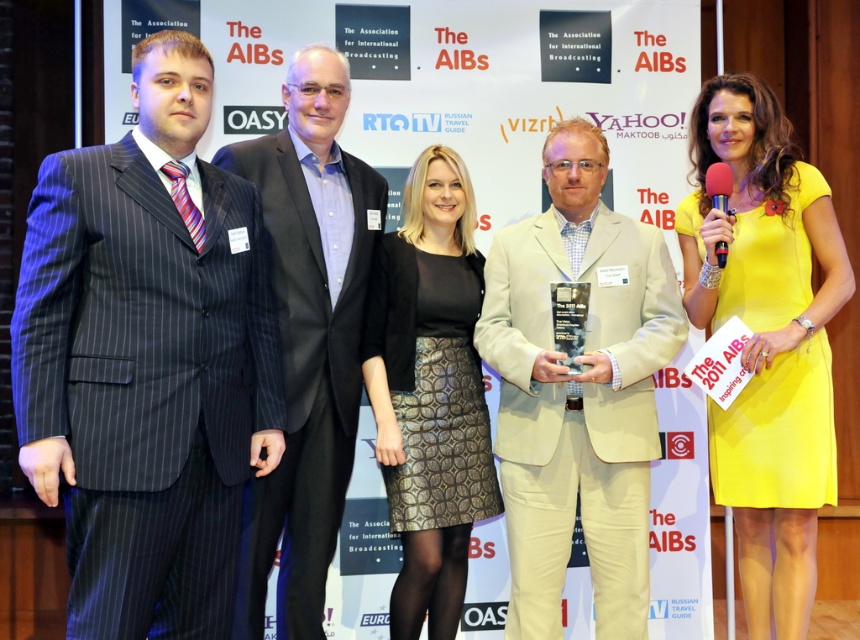
Is beige fabric suit at center wider than dark gray pinstripe suit at left?

Yes, beige fabric suit at center is wider than dark gray pinstripe suit at left.

This screenshot has width=860, height=640. What do you see at coordinates (576, 388) in the screenshot?
I see `beige fabric suit at center` at bounding box center [576, 388].

This screenshot has width=860, height=640. What do you see at coordinates (576, 388) in the screenshot?
I see `beige fabric suit at center` at bounding box center [576, 388].

The width and height of the screenshot is (860, 640). In order to click on beige fabric suit at center in this screenshot , I will do `click(576, 388)`.

Does matte pinstripe suit at left have a lesser width compared to black textured skirt at center?

In fact, matte pinstripe suit at left might be wider than black textured skirt at center.

Does point (172, 131) come behind point (415, 285)?

No, (172, 131) is closer to viewer.

Does point (81, 218) come farther from viewer compared to point (447, 432)?

No, (81, 218) is closer to viewer.

I want to click on matte pinstripe suit at left, so click(x=146, y=360).

Is point (717, 300) farther from camera compared to point (234, 624)?

Yes, point (717, 300) is behind point (234, 624).

Who is taller, yellow satin dress at right or dark gray pinstripe suit at left?

With more height is dark gray pinstripe suit at left.

Is point (776, 372) positioned after point (335, 429)?

Yes.

At what (x,y) coordinates should I click in order to perform the action: click on yellow satin dress at right. Please return your answer as a coordinate pair (x, y). Looking at the image, I should click on (766, 339).